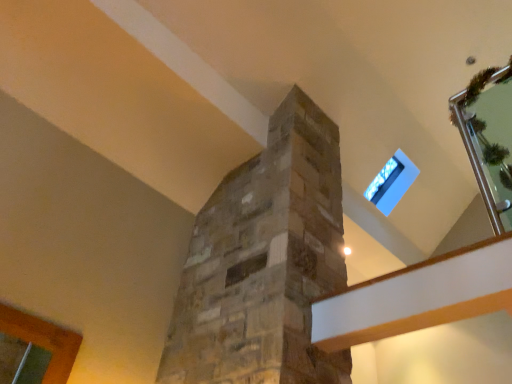
Describe the element at coordinates (384, 180) in the screenshot. I see `transparent glass window at upper right` at that location.

Locate an element on the screen. The image size is (512, 384). transparent glass window at upper right is located at coordinates (384, 180).

What do you see at coordinates (489, 138) in the screenshot? Image resolution: width=512 pixels, height=384 pixels. I see `clear glass door at upper right` at bounding box center [489, 138].

Locate an element on the screen. clear glass door at upper right is located at coordinates (489, 138).

What are the coordinates of `transparent glass window at upper right` in the screenshot? It's located at (384, 180).

Considering the positions of objects transparent glass window at upper right and clear glass door at upper right in the image provided, who is more to the left, transparent glass window at upper right or clear glass door at upper right?

transparent glass window at upper right is more to the left.

Considering the positions of objects transparent glass window at upper right and clear glass door at upper right in the image provided, who is in front, transparent glass window at upper right or clear glass door at upper right?

clear glass door at upper right is more forward.

Which is less distant, (388, 171) or (506, 214)?

Positioned in front is point (506, 214).

From the image's perspective, who appears lower, transparent glass window at upper right or clear glass door at upper right?

transparent glass window at upper right is shown below in the image.

From a real-world perspective, between transparent glass window at upper right and clear glass door at upper right, who is vertically lower?

clear glass door at upper right, from a real-world perspective.

Does transparent glass window at upper right have a lesser width compared to clear glass door at upper right?

Yes.

In terms of height, does transparent glass window at upper right look taller or shorter compared to clear glass door at upper right?

Considering their sizes, transparent glass window at upper right has less height than clear glass door at upper right.

Which of these two, transparent glass window at upper right or clear glass door at upper right, is bigger?

clear glass door at upper right.

Do you think transparent glass window at upper right is within clear glass door at upper right, or outside of it?

transparent glass window at upper right exists outside the volume of clear glass door at upper right.

Is transparent glass window at upper right far away from clear glass door at upper right?

Indeed, transparent glass window at upper right is not near clear glass door at upper right.

Is transparent glass window at upper right looking in the opposite direction of clear glass door at upper right?

No, transparent glass window at upper right's orientation is not away from clear glass door at upper right.

Find the location of a particular element. window above the clear glass door at upper right (from a real-world perspective) is located at coordinates (384, 180).

Would you say clear glass door at upper right is to the left or to the right of transparent glass window at upper right in the picture?

Based on their positions, clear glass door at upper right is located to the right of transparent glass window at upper right.

Is the depth of clear glass door at upper right greater than that of transparent glass window at upper right?

No, clear glass door at upper right is closer to the viewer.

Considering the points (457, 101) and (393, 158), which point is in front, point (457, 101) or point (393, 158)?

The point (457, 101) is more forward.

From the image's perspective, between clear glass door at upper right and transparent glass window at upper right, which one is located above?

From the image's view, clear glass door at upper right is above.

From a real-world perspective, is clear glass door at upper right above or below transparent glass window at upper right?

clear glass door at upper right is situated lower than transparent glass window at upper right in the real world.

Which of these two, clear glass door at upper right or transparent glass window at upper right, is wider?

With larger width is clear glass door at upper right.

Does clear glass door at upper right have a greater height compared to transparent glass window at upper right?

Yes, clear glass door at upper right is taller than transparent glass window at upper right.

Between clear glass door at upper right and transparent glass window at upper right, which one has smaller size?

transparent glass window at upper right.

Is clear glass door at upper right inside or outside of transparent glass window at upper right?

clear glass door at upper right is not enclosed by transparent glass window at upper right.

Is clear glass door at upper right not near transparent glass window at upper right?

clear glass door at upper right is positioned a significant distance from transparent glass window at upper right.

Is clear glass door at upper right looking in the opposite direction of transparent glass window at upper right?

clear glass door at upper right is not turned away from transparent glass window at upper right.

How many degrees apart are the facing directions of clear glass door at upper right and transparent glass window at upper right?

clear glass door at upper right and transparent glass window at upper right are facing 87.7 degrees away from each other.

How far apart are clear glass door at upper right and transparent glass window at upper right?

clear glass door at upper right is 1.16 meters away from transparent glass window at upper right.

Where is `window behind the clear glass door at upper right`? The width and height of the screenshot is (512, 384). window behind the clear glass door at upper right is located at coordinates (384, 180).

Identify the location of glass door below the transparent glass window at upper right (from a real-world perspective). (489, 138).

You are a GUI agent. You are given a task and a screenshot of the screen. Output one action in this format:
    pyautogui.click(x=<x>, y=<y>)
    Task: Click on the window behind the clear glass door at upper right
    This screenshot has height=384, width=512.
    Given the screenshot: What is the action you would take?
    pyautogui.click(x=384, y=180)